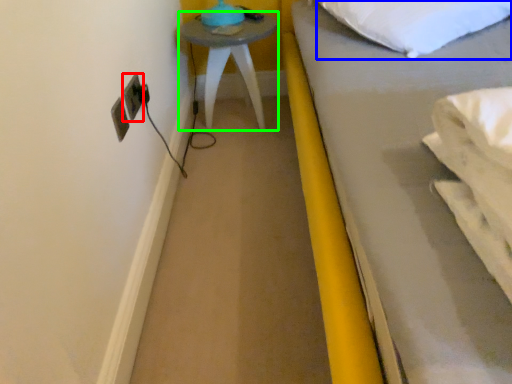
Question: Considering the real-world distances, which object is farthest from electric outlet (highlighted by a red box)? pillow (highlighted by a blue box) or furniture (highlighted by a green box)?

Choices:
 (A) pillow
 (B) furniture

Answer: (A)